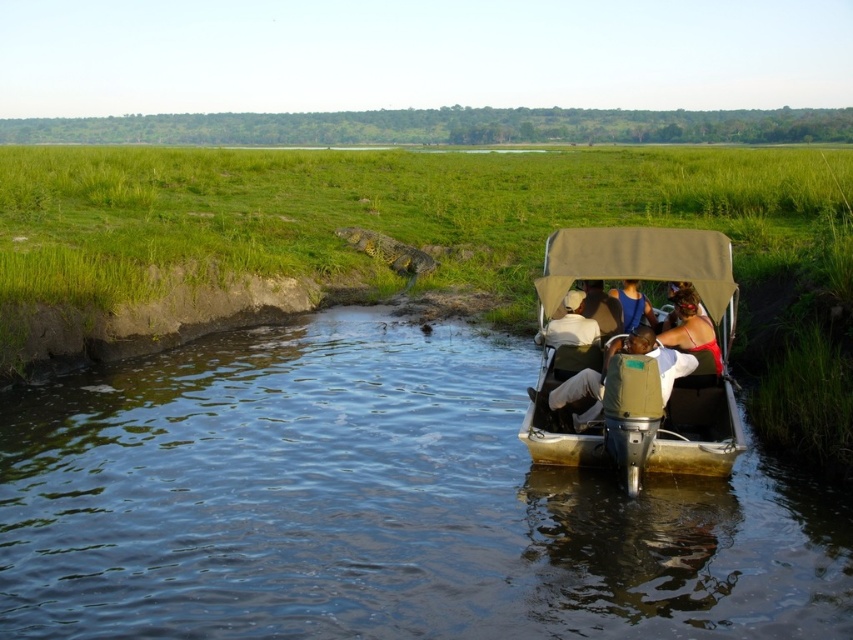
You are a photographer on the boat and want to take a photo of both the red fabric person at center and the light brown fabric hat at center. Which object should you adjust your camera to focus on first if you want to capture both in the frame without moving the camera?

You should focus on the light brown fabric hat at center first because it is positioned to the left of the red fabric person at center, so capturing it first ensures both are in the frame without needing to reposition the camera.

You are standing on the dock and see the red fabric person at center in the boat. If you want to throw a lifebuoy to them, will it reach them?

The red fabric person at center and viewer are 9.43 meters apart. The average throwing distance for a lifebuoy is around 10 meters, so it might not reach them unless thrown with extra force.